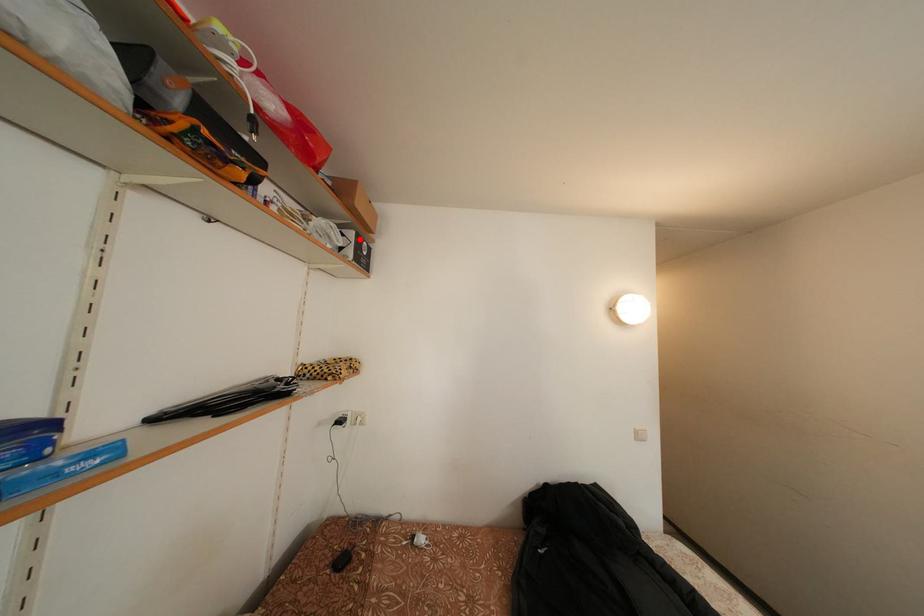
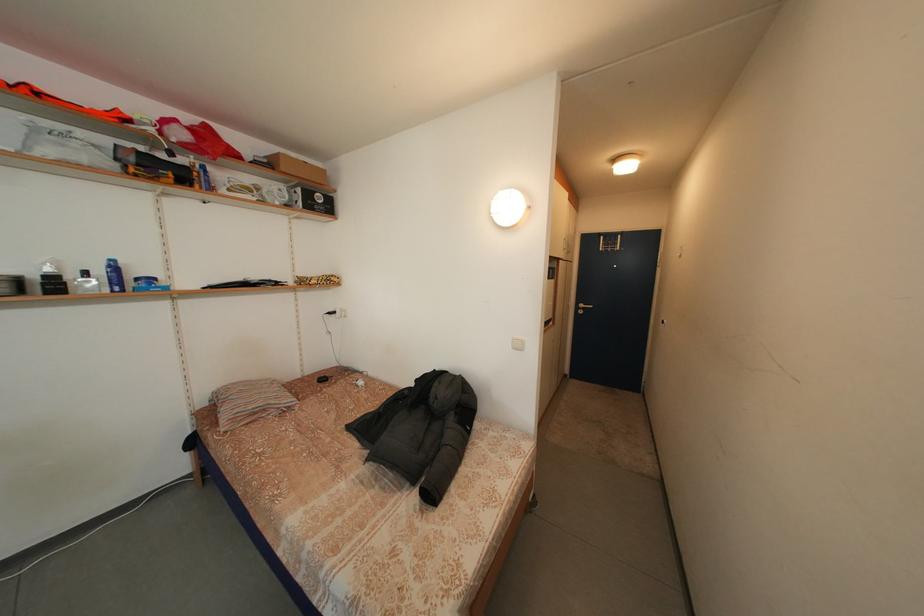
Where in the second image is the point corresponding to the highlighted location from the first image?

(307, 196)